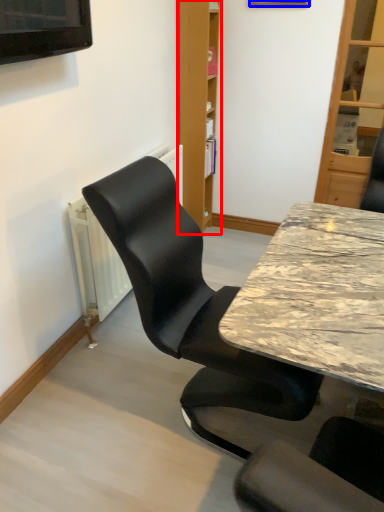
Question: Which object is closer to the camera taking this photo, bookshelf (highlighted by a red box) or picture frame (highlighted by a blue box)?

Choices:
 (A) bookshelf
 (B) picture frame

Answer: (B)